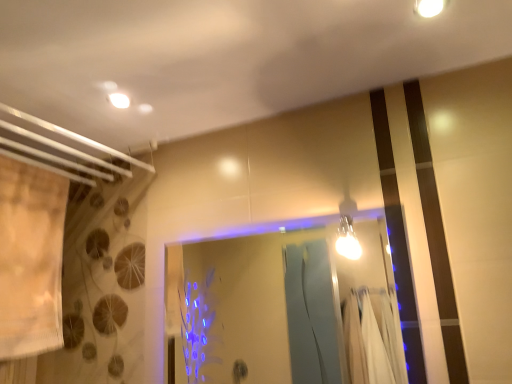
Looking at this image, measure the distance between point [115,105] and camera.

Point [115,105] is 4.48 feet from camera.

What do you see at coordinates (283, 310) in the screenshot? I see `transparent glass door at center` at bounding box center [283, 310].

Identify the location of bright metallic bulb at upper right, the 1th light fixture when ordered from bottom to top. This screenshot has width=512, height=384. (347, 239).

Visually, is transparent glass door at center positioned to the left or to the right of beige fabric shower curtain at left?

transparent glass door at center is to the right of beige fabric shower curtain at left.

Image resolution: width=512 pixels, height=384 pixels. In order to click on shower curtain positioned vertically above the transparent glass door at center (from a real-world perspective) in this screenshot , I will do `click(30, 259)`.

Is transparent glass door at center touching beige fabric shower curtain at left?

No, transparent glass door at center is not touching beige fabric shower curtain at left.

Is transparent glass door at center spatially inside beige fabric shower curtain at left, or outside of it?

transparent glass door at center is not inside beige fabric shower curtain at left, it's outside.

Between point (379, 245) and point (414, 5), which one is positioned in front?

Positioned in front is point (414, 5).

Is transparent glass door at center positioned with its back to white glossy light fixture at upper right, the second light fixture from the left?

transparent glass door at center is not turned away from white glossy light fixture at upper right, the second light fixture from the left.

Consider the image. Does transparent glass door at center have a lesser width compared to white glossy light fixture at upper right, the 2th light fixture positioned from the bottom?

Correct, the width of transparent glass door at center is less than that of white glossy light fixture at upper right, the 2th light fixture positioned from the bottom.

Does point (56, 203) lie in front of point (372, 231)?

Yes, it is in front of point (372, 231).

Can you confirm if beige fabric shower curtain at left is smaller than transparent glass door at center?

Actually, beige fabric shower curtain at left might be larger than transparent glass door at center.

From a real-world perspective, is beige fabric shower curtain at left located higher than transparent glass door at center?

Yes, from a real-world perspective, beige fabric shower curtain at left is above transparent glass door at center.

Is beige fabric shower curtain at left spatially inside transparent glass door at center, or outside of it?

beige fabric shower curtain at left is located beyond the bounds of transparent glass door at center.

Can you tell me how much white glossy light fixture at upper right, arranged as the first light fixture when viewed from the right, and matte white light fixture at upper left differ in facing direction?

90 degrees separate the facing orientations of white glossy light fixture at upper right, arranged as the first light fixture when viewed from the right, and matte white light fixture at upper left.

Find the location of a particular element. light fixture above the matte white light fixture at upper left (from the image's perspective) is located at coordinates (428, 7).

Between white glossy light fixture at upper right, which ranks as the 1th light fixture in top-to-bottom order, and matte white light fixture at upper left, which one has smaller size?

matte white light fixture at upper left.

From the image's perspective, is bright metallic bulb at upper right, acting as the 1th light fixture starting from the left, located beneath transparent glass door at center?

No.

Is bright metallic bulb at upper right, which ranks as the second light fixture in right-to-left order, aimed at transparent glass door at center?

Yes, bright metallic bulb at upper right, which ranks as the second light fixture in right-to-left order, is turned towards transparent glass door at center.

Does bright metallic bulb at upper right, the 1th light fixture when ordered from back to front, come behind transparent glass door at center?

Yes, the depth of bright metallic bulb at upper right, the 1th light fixture when ordered from back to front, is greater than that of transparent glass door at center.

You are a GUI agent. You are given a task and a screenshot of the screen. Output one action in this format:
    pyautogui.click(x=<x>, y=<y>)
    Task: Click on the 1st light fixture above the beige fabric shower curtain at left (from the image's perspective)
    
    Given the screenshot: What is the action you would take?
    pyautogui.click(x=347, y=239)

Does bright metallic bulb at upper right, which is the second light fixture from front to back, appear on the left side of beige fabric shower curtain at left?

Incorrect, bright metallic bulb at upper right, which is the second light fixture from front to back, is not on the left side of beige fabric shower curtain at left.

From a real-world perspective, does bright metallic bulb at upper right, the 1th light fixture when ordered from back to front, sit lower than beige fabric shower curtain at left?

No, from a real-world perspective, bright metallic bulb at upper right, the 1th light fixture when ordered from back to front, is not beneath beige fabric shower curtain at left.

Considering the sizes of objects bright metallic bulb at upper right, which ranks as the second light fixture in right-to-left order, and beige fabric shower curtain at left in the image provided, who is taller, bright metallic bulb at upper right, which ranks as the second light fixture in right-to-left order, or beige fabric shower curtain at left?

With more height is beige fabric shower curtain at left.

Are matte white light fixture at upper left and beige fabric shower curtain at left making contact?

matte white light fixture at upper left and beige fabric shower curtain at left are clearly separated.

From a real-world perspective, which object rests below the other?

In real-world perspective, beige fabric shower curtain at left is lower.

Based on their positions, is matte white light fixture at upper left located to the left or right of beige fabric shower curtain at left?

From the image, it's evident that matte white light fixture at upper left is to the right of beige fabric shower curtain at left.

Is matte white light fixture at upper left taller or shorter than beige fabric shower curtain at left?

matte white light fixture at upper left is shorter than beige fabric shower curtain at left.

Locate an element on the screen. shower curtain that is above the transparent glass door at center (from a real-world perspective) is located at coordinates (30, 259).

Locate an element on the screen. glass door directly beneath the white glossy light fixture at upper right, which ranks as the 1th light fixture in top-to-bottom order (from a real-world perspective) is located at coordinates (283, 310).

From the image, which object appears to be nearer to transparent glass door at center, beige fabric shower curtain at left or bright metallic bulb at upper right, the 1th light fixture when ordered from bottom to top?

bright metallic bulb at upper right, the 1th light fixture when ordered from bottom to top, is positioned closer to the anchor transparent glass door at center.

In the scene shown: Looking at the image, which one is located further to transparent glass door at center, matte white light fixture at upper left or beige fabric shower curtain at left?

Based on the image, matte white light fixture at upper left appears to be further to transparent glass door at center.

Looking at this image, looking at the image, which one is located further to beige fabric shower curtain at left, white glossy light fixture at upper right, which ranks as the 1th light fixture in top-to-bottom order, or transparent glass door at center?

The object further to beige fabric shower curtain at left is white glossy light fixture at upper right, which ranks as the 1th light fixture in top-to-bottom order.

Which object lies further to the anchor point bright metallic bulb at upper right, which ranks as the second light fixture in right-to-left order, matte white light fixture at upper left or beige fabric shower curtain at left?

beige fabric shower curtain at left.

Considering their positions, is matte white light fixture at upper left positioned further to bright metallic bulb at upper right, which is the second light fixture from front to back, than transparent glass door at center?

The object further to bright metallic bulb at upper right, which is the second light fixture from front to back, is matte white light fixture at upper left.

From the image, which object appears to be nearer to bright metallic bulb at upper right, the 1th light fixture when ordered from bottom to top, matte white light fixture at upper left or white glossy light fixture at upper right, arranged as the first light fixture when viewed from the right?

matte white light fixture at upper left is closer to bright metallic bulb at upper right, the 1th light fixture when ordered from bottom to top.

When comparing their distances from beige fabric shower curtain at left, does bright metallic bulb at upper right, the 1th light fixture when ordered from bottom to top, or matte white light fixture at upper left seem closer?

matte white light fixture at upper left lies closer to beige fabric shower curtain at left than the other object.

When comparing their distances from transparent glass door at center, does bright metallic bulb at upper right, acting as the 1th light fixture starting from the left, or matte white light fixture at upper left seem closer?

Based on the image, bright metallic bulb at upper right, acting as the 1th light fixture starting from the left, appears to be nearer to transparent glass door at center.

Where is `light fixture between white glossy light fixture at upper right, the second light fixture from the left, and transparent glass door at center vertically`? Image resolution: width=512 pixels, height=384 pixels. light fixture between white glossy light fixture at upper right, the second light fixture from the left, and transparent glass door at center vertically is located at coordinates point(347,239).

Identify the location of lighting that lies between white glossy light fixture at upper right, positioned as the 2th light fixture in back-to-front order, and transparent glass door at center from top to bottom. (119, 100).

The height and width of the screenshot is (384, 512). What are the coordinates of `lighting between beige fabric shower curtain at left and white glossy light fixture at upper right, the 2th light fixture positioned from the bottom, in the horizontal direction` in the screenshot? It's located at (119, 100).

The width and height of the screenshot is (512, 384). In order to click on light fixture located between matte white light fixture at upper left and white glossy light fixture at upper right, which ranks as the 1th light fixture in top-to-bottom order, in the left-right direction in this screenshot , I will do `click(347, 239)`.